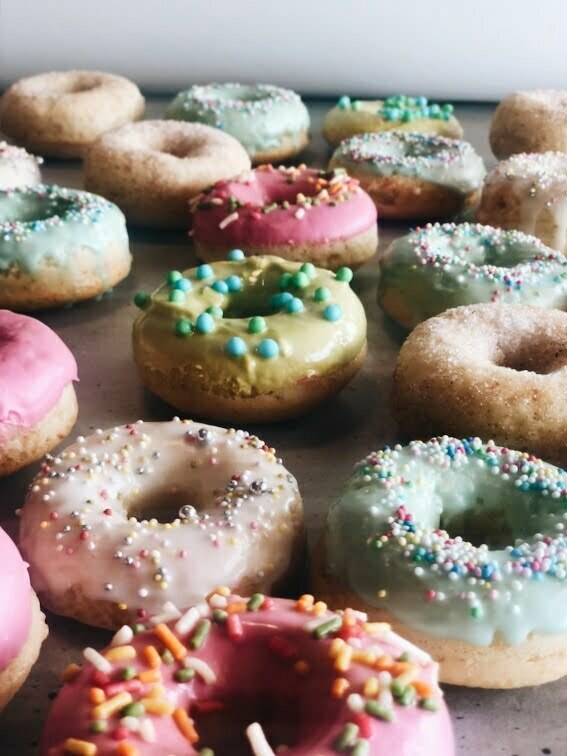
Locate an element on the screen. This screenshot has height=756, width=567. table is located at coordinates (350, 423).